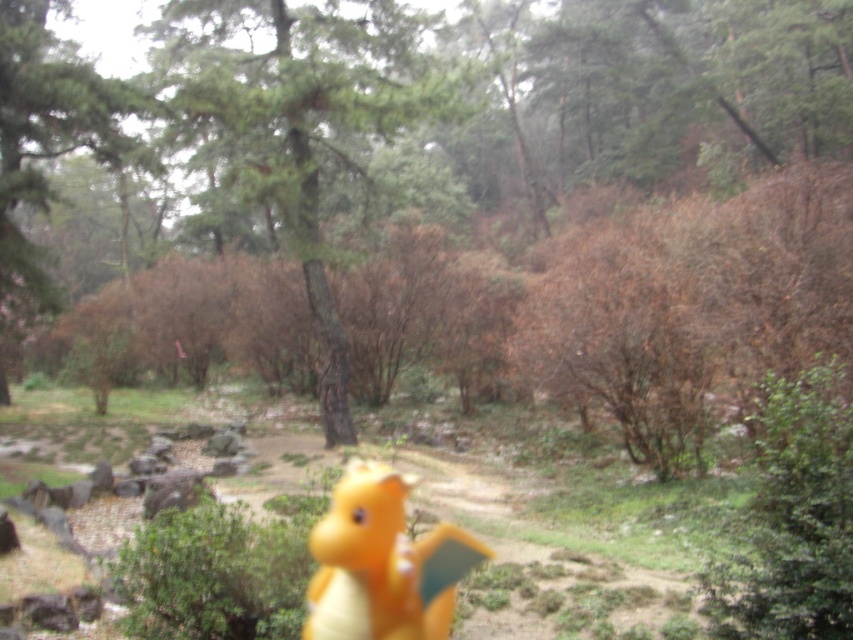
Question: Can you confirm if green matte tree at center is positioned below green matte tree at upper left?

Choices:
 (A) no
 (B) yes

Answer: (A)

Question: Is green matte tree at upper left above orange matte toy dragon at center?

Choices:
 (A) yes
 (B) no

Answer: (A)

Question: Which point is farther from the camera taking this photo?

Choices:
 (A) (345, 470)
 (B) (697, 324)
 (C) (364, 118)
 (D) (32, 131)

Answer: (D)

Question: Which point is closer to the camera?

Choices:
 (A) green matte tree at center
 (B) green textured tree at upper center
 (C) green matte tree at upper left
 (D) orange matte toy dragon at center

Answer: (D)

Question: Can you confirm if green matte tree at upper left is positioned to the right of orange matte toy dragon at center?

Choices:
 (A) no
 (B) yes

Answer: (A)

Question: Which point is farther to the camera?

Choices:
 (A) (398, 580)
 (B) (16, 58)
 (C) (202, 115)

Answer: (B)